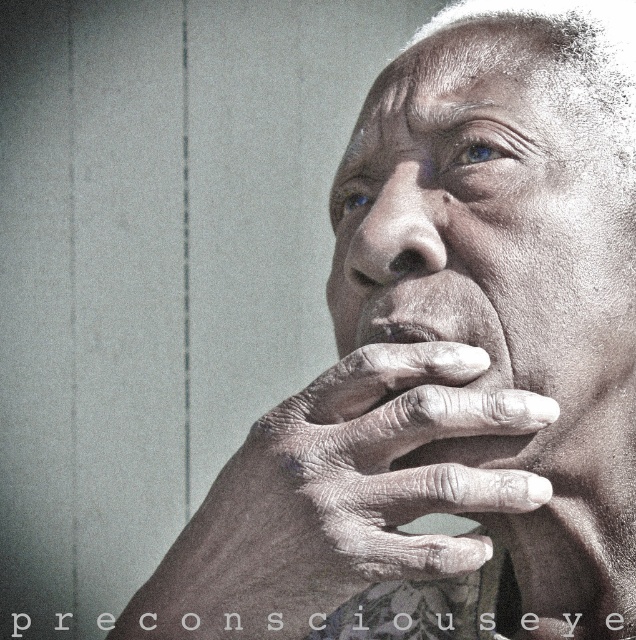
Question: Which point is farther from the camera taking this photo?

Choices:
 (A) (424, 250)
 (B) (429, 426)
 (C) (415, 320)
 (D) (492, 68)

Answer: (D)

Question: Which of the following is the closest to the observer?

Choices:
 (A) (218, 568)
 (B) (429, 148)

Answer: (A)

Question: Can you confirm if smooth skin face at center is smaller than smooth skin nose at center?

Choices:
 (A) no
 (B) yes

Answer: (A)

Question: Which object appears farthest from the camera in this image?

Choices:
 (A) smooth skin nose at center
 (B) smooth skin face at center
 (C) gray textured hand at center

Answer: (A)

Question: Is smooth skin face at center below smooth skin mouth at center?

Choices:
 (A) no
 (B) yes

Answer: (A)

Question: Is gray textured hand at center further to camera compared to smooth skin nose at center?

Choices:
 (A) no
 (B) yes

Answer: (A)